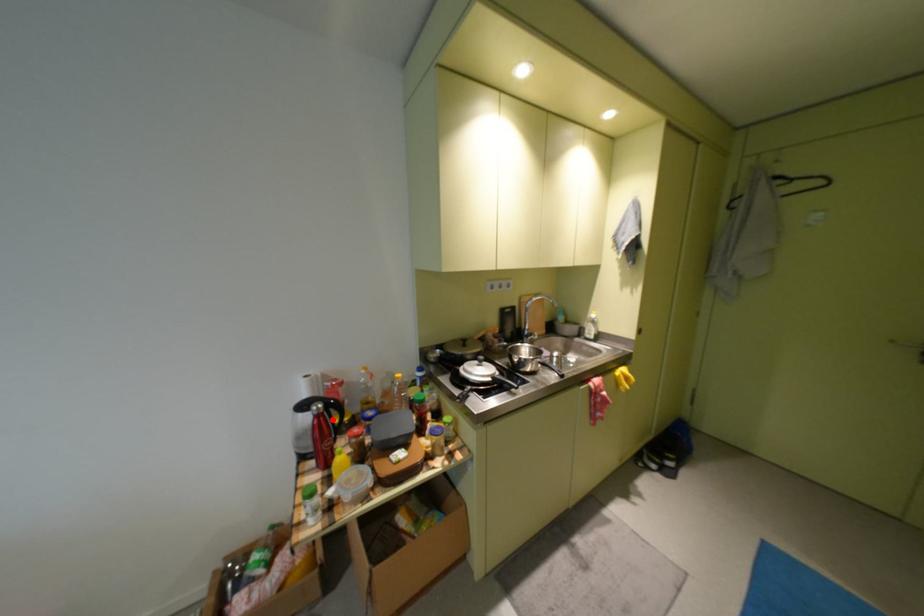
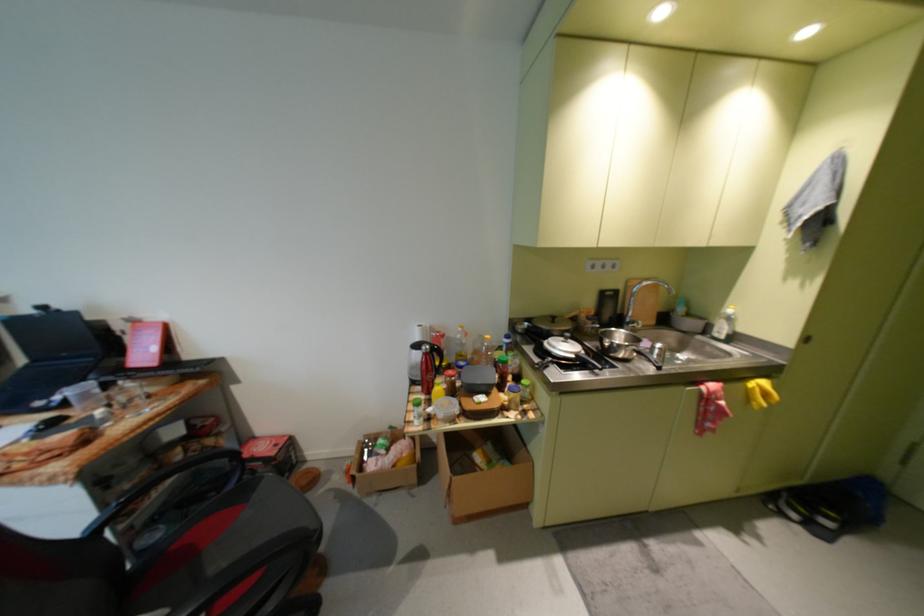
In the second image, find the point that corresponds to the highlighted location in the first image.

(439, 358)